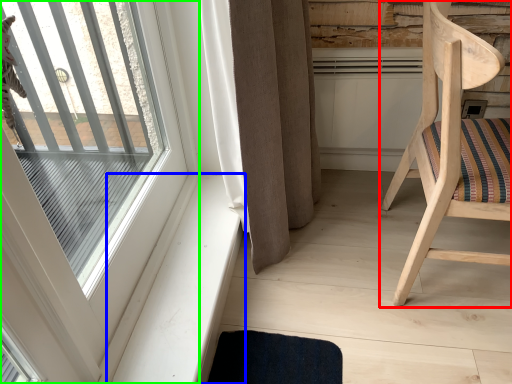
Question: Which object is the closest to the chair (highlighted by a red box)? Choose among these: window sill (highlighted by a blue box) or window (highlighted by a green box).

Choices:
 (A) window sill
 (B) window

Answer: (A)